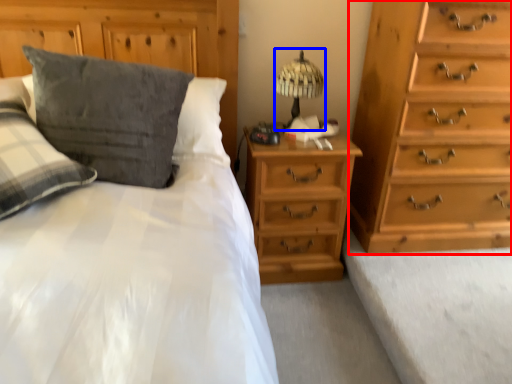
Question: Among these objects, which one is farthest to the camera, chest of drawers (highlighted by a red box) or table lamp (highlighted by a blue box)?

Choices:
 (A) chest of drawers
 (B) table lamp

Answer: (B)